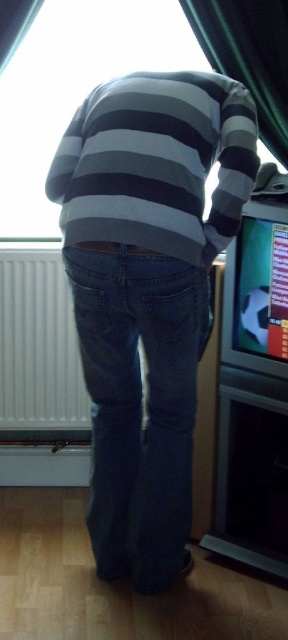
Is denim jeans at center smaller than white plastic radiator at lower left?

No.

Does point (222, 108) lie behind point (17, 348)?

No, (222, 108) is closer to viewer.

Identify the location of denim jeans at center. (148, 291).

Is denim jeans at center taller than green fabric curtain at upper center?

Correct, denim jeans at center is much taller as green fabric curtain at upper center.

Locate an element on the screen. The image size is (288, 640). denim jeans at center is located at coordinates (148, 291).

Does white plastic radiator at lower left appear over green fabric curtain at upper center?

No.

Measure the distance from white plastic radiator at lower left to green fabric curtain at upper center.

white plastic radiator at lower left and green fabric curtain at upper center are 4.09 feet apart.

Identify the location of white plastic radiator at lower left. The width and height of the screenshot is (288, 640). (38, 346).

Where is `white plastic radiator at lower left`? This screenshot has height=640, width=288. white plastic radiator at lower left is located at coordinates (38, 346).